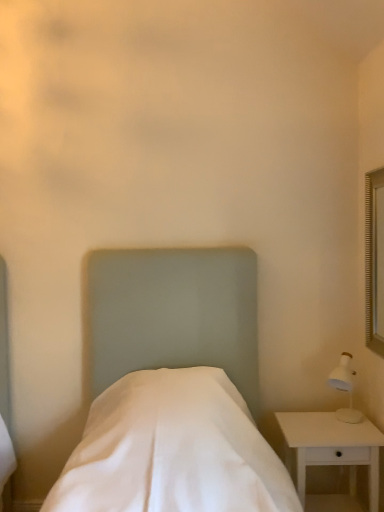
Question: In terms of size, does white wood nightstand at lower right appear bigger or smaller than white fabric bed at center?

Choices:
 (A) small
 (B) big

Answer: (A)

Question: In the image, is white wood nightstand at lower right positioned in front of or behind white fabric bed at center?

Choices:
 (A) front
 (B) behind

Answer: (B)

Question: Looking at their shapes, would you say white wood nightstand at lower right is wider or thinner than white fabric bed at center?

Choices:
 (A) wide
 (B) thin

Answer: (B)

Question: Is white fabric bed at center wider or thinner than white wood nightstand at lower right?

Choices:
 (A) thin
 (B) wide

Answer: (B)

Question: Would you say white fabric bed at center is to the left or to the right of white wood nightstand at lower right in the picture?

Choices:
 (A) right
 (B) left

Answer: (B)

Question: Is point (129, 271) closer or farther from the camera than point (357, 456)?

Choices:
 (A) closer
 (B) farther

Answer: (B)

Question: Do you think white fabric bed at center is within white wood nightstand at lower right, or outside of it?

Choices:
 (A) outside
 (B) inside

Answer: (A)